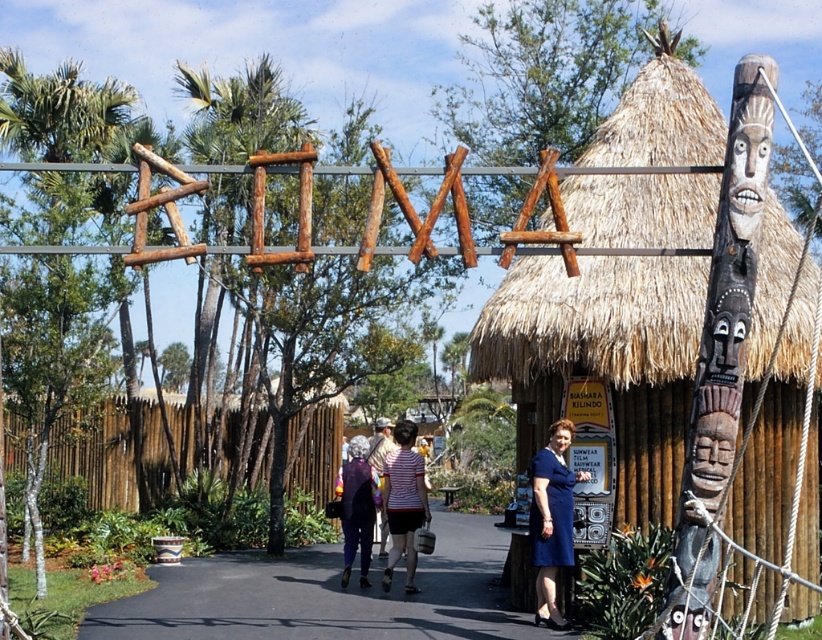
You are a photographer planning to capture a photo of the striped cotton shirt at center and dark purple fabric dress at center. Which clothing item should you focus on first if you want to start from the left side of the scene?

→ The dark purple fabric dress at center should be focused on first because it is positioned to the left of the striped cotton shirt at center.

You are planning to take a photo of the dark brown wood totem pole at right and the green leafy palm tree at left. Which object should you focus on first if you want to capture both in the frame without moving the camera? Explain your reasoning based on their sizes.

The dark brown wood totem pole at right is smaller than the green leafy palm tree at left. To include both in the frame without moving the camera, focus on the larger object first, which is the green leafy palm tree at left, as it occupies more space and ensures the smaller totem pole can fit alongside it.

You are planning to set up a small bench between the thatched straw hut at center and the dark brown wood totem pole at right. Based on their sizes, which object should the bench be closer to?

A: The thatched straw hut at center might be wider than dark brown wood totem pole at right, so the bench should be placed closer to the thatched straw hut at center to accommodate its larger size.